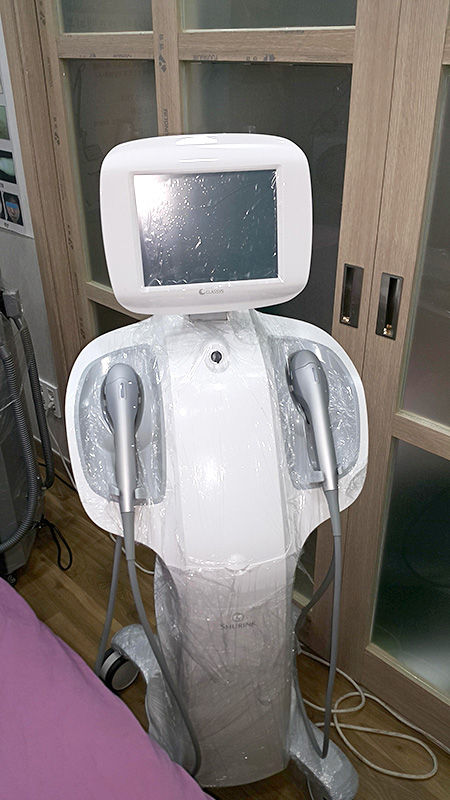
Where is `white painted wall`? The width and height of the screenshot is (450, 800). white painted wall is located at coordinates (20, 258).